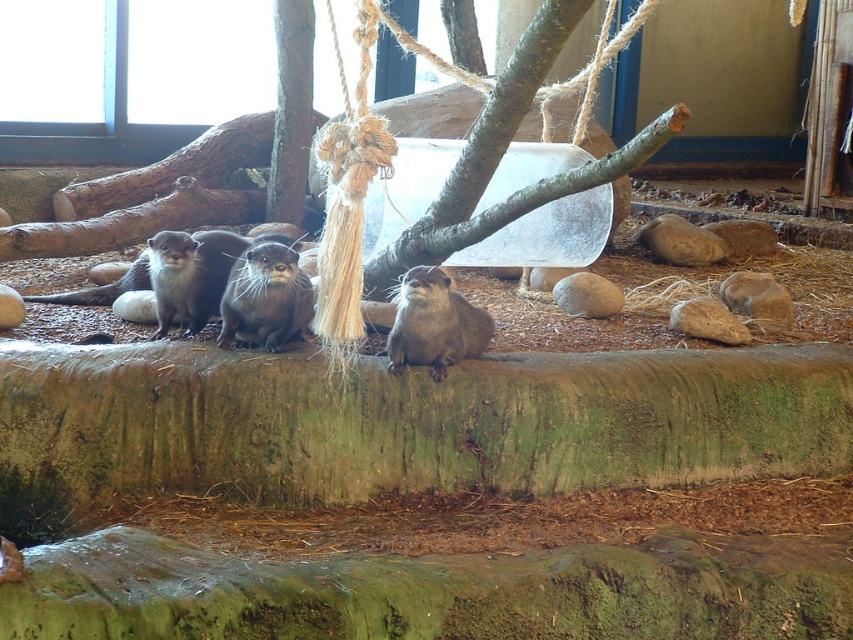
Is shiny brown otter at center thinner than soft brown fur otter at center?

Correct, shiny brown otter at center's width is less than soft brown fur otter at center's.

Does shiny brown otter at center have a greater width compared to soft brown fur otter at center?

No.

Does point (277, 321) lie behind point (479, 307)?

No, it is in front of (479, 307).

Locate an element on the screen. The image size is (853, 640). shiny brown otter at center is located at coordinates (265, 296).